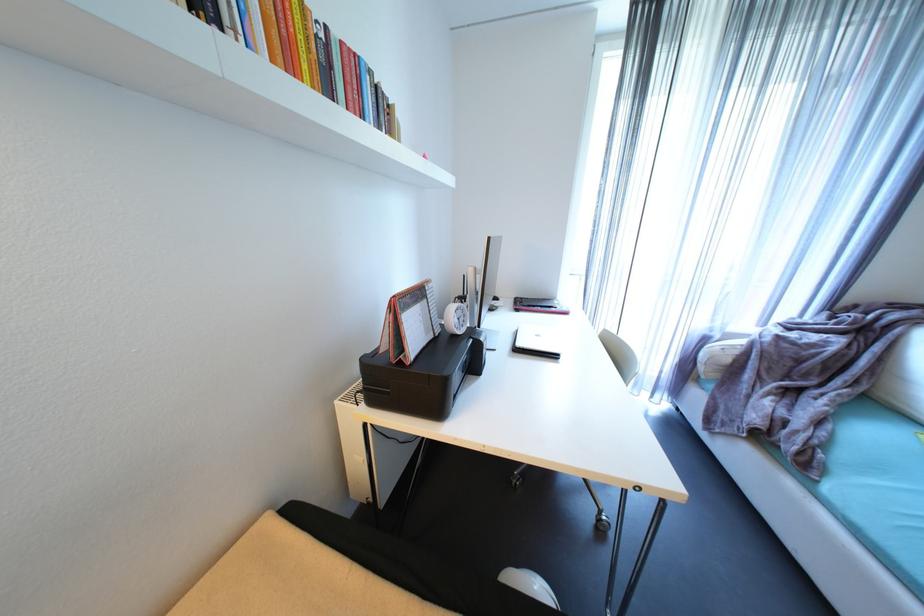
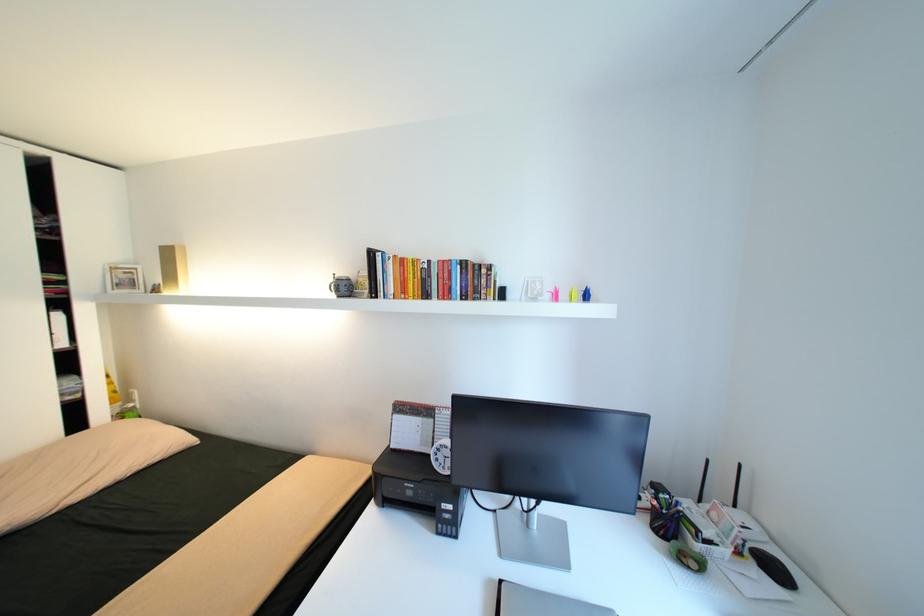
In the second image, find the point that corresponds to point 347,42 in the first image.

(445, 262)